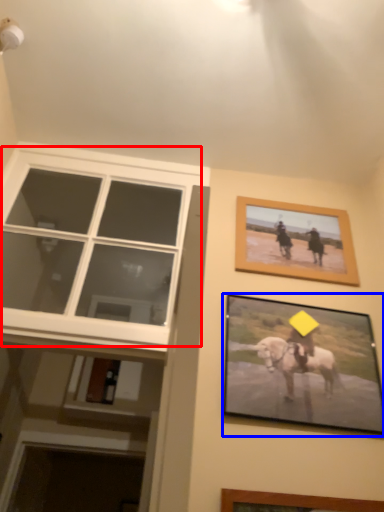
Question: Which object appears farthest to the camera in this image, window (highlighted by a red box) or picture frame (highlighted by a blue box)?

Choices:
 (A) window
 (B) picture frame

Answer: (A)